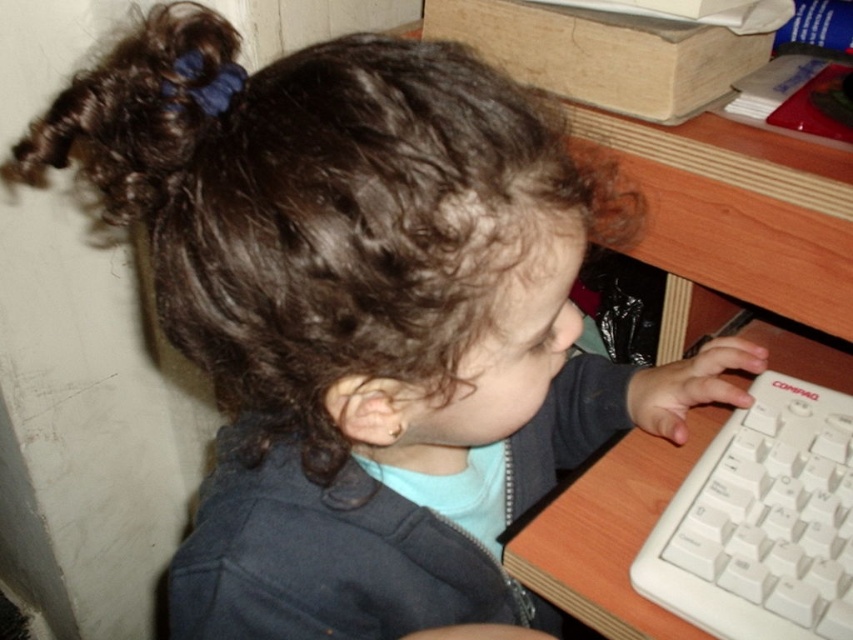
Question: From the image, what is the correct spatial relationship of white plastic keyboard at right in relation to dark curly hair at upper left?

Choices:
 (A) above
 (B) below

Answer: (B)

Question: Is white plastic keyboard at right positioned before dark curly hair at upper left?

Choices:
 (A) no
 (B) yes

Answer: (A)

Question: Can you confirm if white plastic keyboard at right is positioned below dark curly hair at upper left?

Choices:
 (A) yes
 (B) no

Answer: (A)

Question: Which point appears closest to the camera in this image?

Choices:
 (A) (799, 444)
 (B) (85, 150)

Answer: (A)

Question: Which point is closer to the camera?

Choices:
 (A) white plastic keyboard at right
 (B) dark curly hair at upper left

Answer: (B)